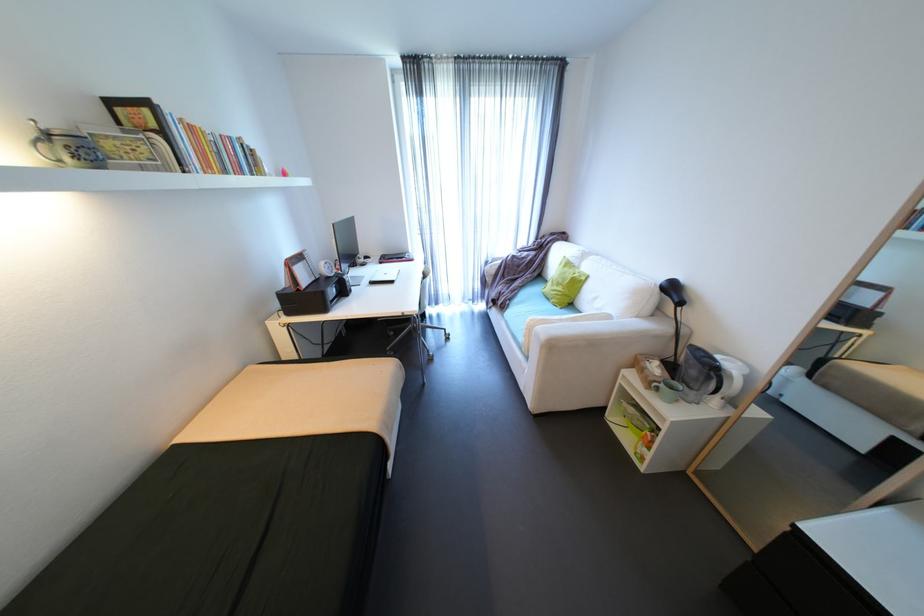
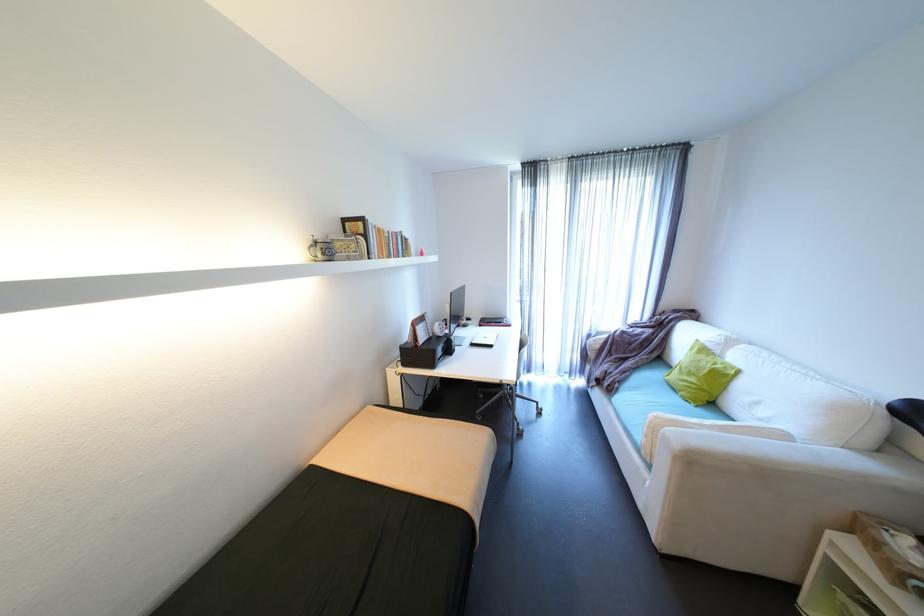
Where in the second image is the point corresponding to pixel 301 264 from the first image?

(426, 323)